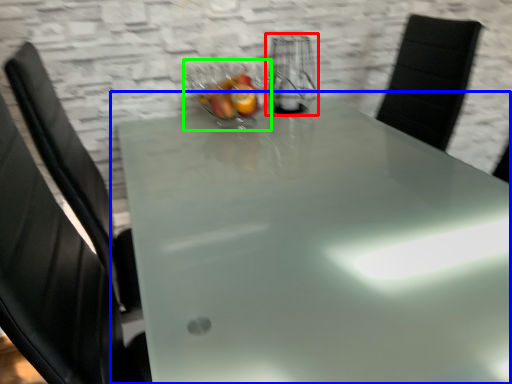
Question: Which object is positioned farthest from appliance (highlighted by a red box)? Select from table (highlighted by a blue box) and glass bowl (highlighted by a green box).

Choices:
 (A) table
 (B) glass bowl

Answer: (A)